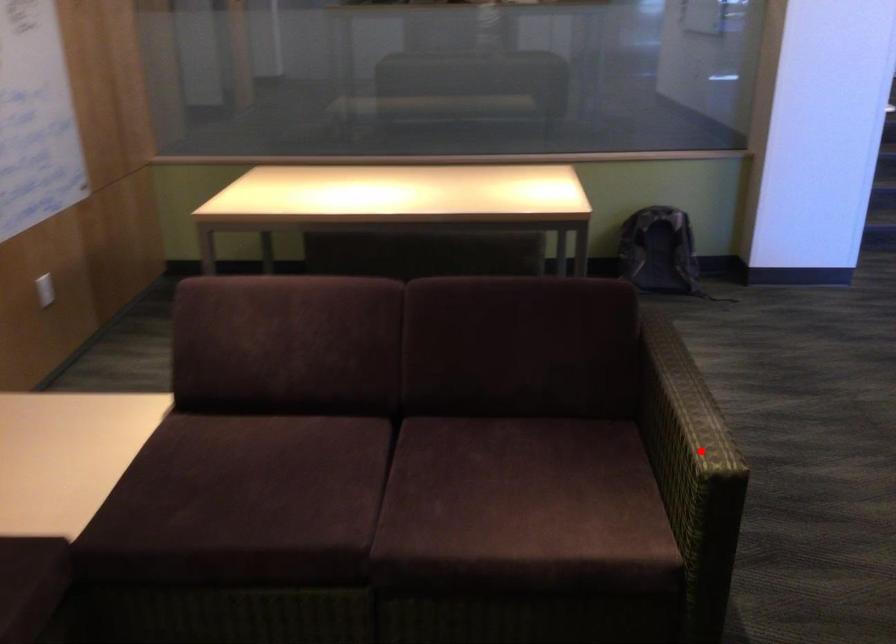
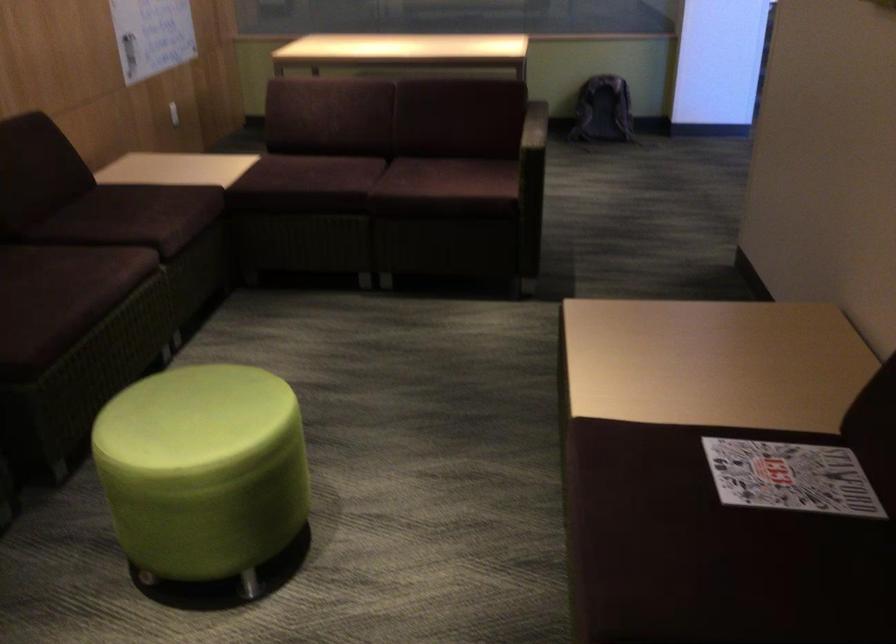
Question: I am providing you with two images of the same scene from different viewpoints. Image1 has a red point marked. In image2, the corresponding 3D location appears at what relative position? Reply with the corresponding letter.

Choices:
 (A) Closer
 (B) Farther

Answer: (B)